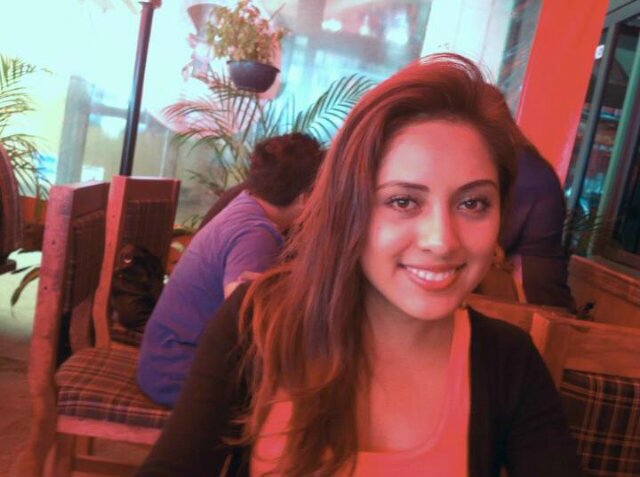
Locate an element on the screen. hanging potted plant is located at coordinates (253, 78).